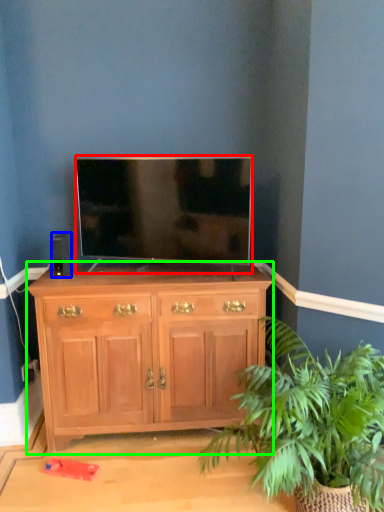
Question: Which is nearer to the television (highlighted by a red box)? speaker (highlighted by a blue box) or chest of drawers (highlighted by a green box).

Choices:
 (A) speaker
 (B) chest of drawers

Answer: (B)